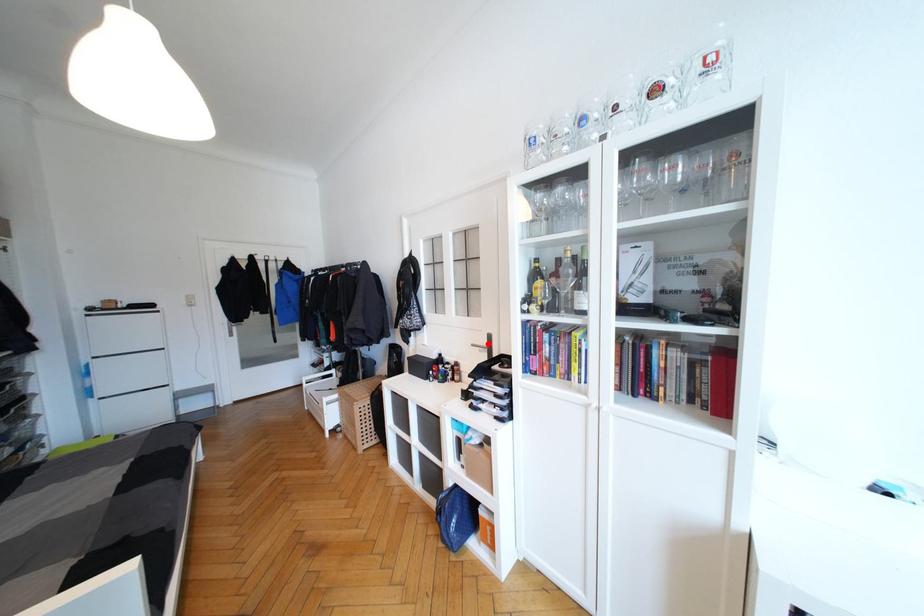
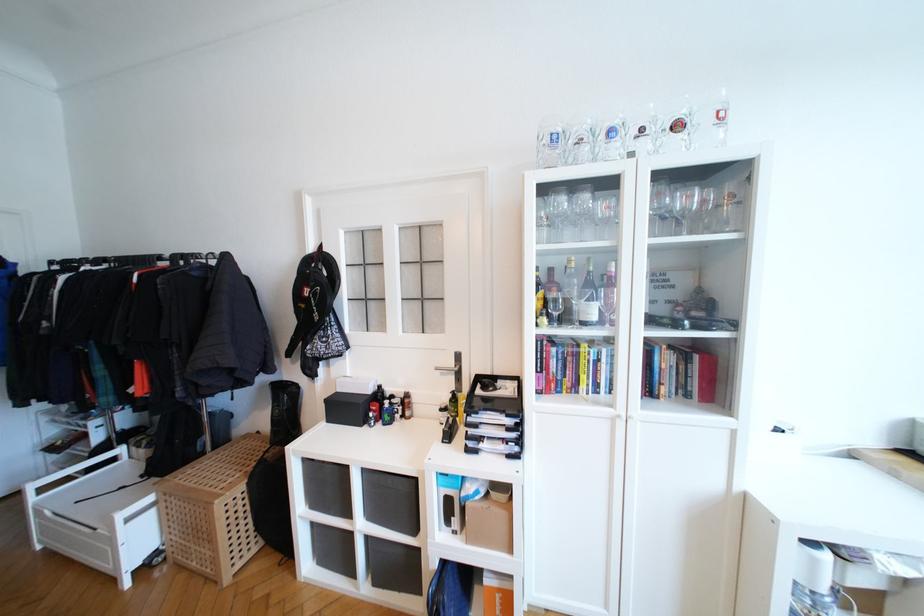
In the second image, find the point that corresponds to the highlighted location in the first image.

(455, 363)